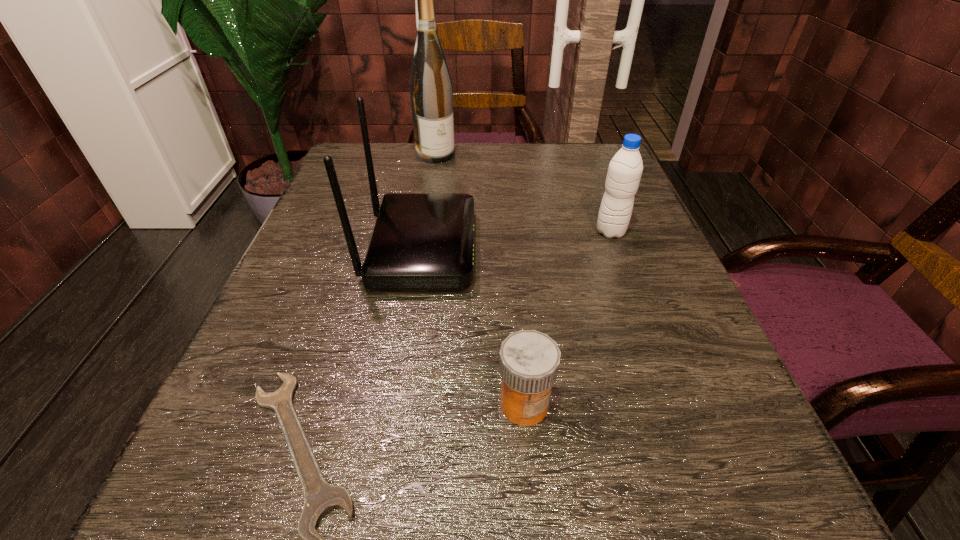
This screenshot has width=960, height=540. What are the coordinates of `the tallest object` in the screenshot? It's located at (430, 85).

Image resolution: width=960 pixels, height=540 pixels. Identify the location of the farthest object. (430, 85).

At what (x,y) coordinates should I click in order to perform the action: click on router. Please return your answer as a coordinate pair (x, y). The width and height of the screenshot is (960, 540). Looking at the image, I should click on (420, 240).

Locate an element on the screen. This screenshot has height=540, width=960. the rightmost object is located at coordinates (625, 169).

Identify the location of the third shortest object. The image size is (960, 540). (625, 169).

In order to click on the second object from right to left in this screenshot , I will do `click(529, 360)`.

You are a GUI agent. You are given a task and a screenshot of the screen. Output one action in this format:
    pyautogui.click(x=<x>, y=<y>)
    Task: Click on the second shortest object
    This screenshot has height=540, width=960.
    Given the screenshot: What is the action you would take?
    (529, 360)

You are a GUI agent. You are given a task and a screenshot of the screen. Output one action in this format:
    pyautogui.click(x=<x>, y=<y>)
    Task: Click on the free space located on the front of the tallest object
    Image resolution: width=960 pixels, height=540 pixels.
    Given the screenshot: What is the action you would take?
    pyautogui.click(x=422, y=238)

This screenshot has height=540, width=960. I want to click on free space located 0.100m on the front-facing side of the fourth shortest object, so click(x=528, y=249).

At what (x,y) coordinates should I click in order to perform the action: click on free space located on the left of the third shortest object. Please return your answer as a coordinate pair (x, y). Looking at the image, I should click on (421, 232).